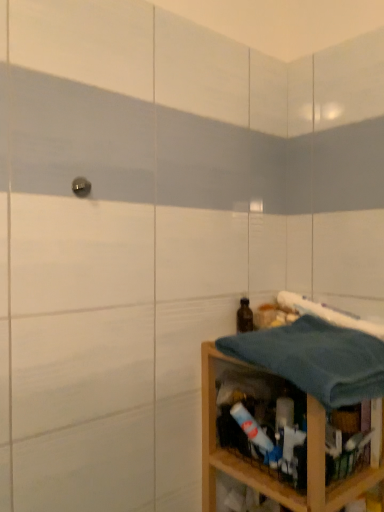
At what (x,y) coordinates should I click in order to perform the action: click on brown glass bottle at lower right. Please return your answer as a coordinate pair (x, y). Looking at the image, I should click on (244, 316).

The image size is (384, 512). Describe the element at coordinates (327, 313) in the screenshot. I see `blue waffle weave bath towel at right, which is the second bath towel from bottom to top` at that location.

Locate an element on the screen. The width and height of the screenshot is (384, 512). wooden shelf at lower right is located at coordinates (265, 472).

The width and height of the screenshot is (384, 512). What are the coordinates of `blue cotton towel at lower right, acting as the 2th bath towel starting from the top` in the screenshot? It's located at (316, 359).

Is brown glass bottle at lower right to the left or to the right of wooden shelf at lower right in the image?

brown glass bottle at lower right is to the left of wooden shelf at lower right.

Does point (251, 327) come farther from viewer compared to point (296, 503)?

That is True.

In the scene shown: Is brown glass bottle at lower right further to camera compared to wooden shelf at lower right?

Yes, brown glass bottle at lower right is further from the camera.

Is wooden shelf at lower right turned away from brown glass bottle at lower right?

No.

From the picture: Is wooden shelf at lower right inside or outside of brown glass bottle at lower right?

The correct answer is: outside.

Which point is more distant from viewer, [247,366] or [242,322]?

The point [242,322] is farther.

At what (x,y) coordinates should I click in order to perform the action: click on bottle on the left of wooden shelf at lower right. Please return your answer as a coordinate pair (x, y). Image resolution: width=384 pixels, height=512 pixels. Looking at the image, I should click on (244, 316).

Considering the relative positions of wooden shelf at lower right and blue cotton towel at lower right, acting as the 2th bath towel starting from the top, in the image provided, is wooden shelf at lower right to the left or to the right of blue cotton towel at lower right, acting as the 2th bath towel starting from the top,?

wooden shelf at lower right is positioned on blue cotton towel at lower right, acting as the 2th bath towel starting from the top,'s right side.

Is wooden shelf at lower right placed right next to blue cotton towel at lower right, acting as the 2th bath towel starting from the top?

They are not placed beside each other.

Based on the photo, from a real-world perspective, is wooden shelf at lower right physically below blue cotton towel at lower right, acting as the 2th bath towel starting from the top?

Yes.

At what (x,y) coordinates should I click in order to perform the action: click on the 1st bath towel positioned above the wooden shelf at lower right (from the image's perspective). Please return your answer as a coordinate pair (x, y). This screenshot has height=512, width=384. Looking at the image, I should click on click(x=316, y=359).

From the image's perspective, which object appears higher, blue cotton towel at lower right, the first bath towel from the bottom, or blue waffle weave bath towel at right, which is the second bath towel from bottom to top?

blue waffle weave bath towel at right, which is the second bath towel from bottom to top, is shown above in the image.

Is point (336, 373) farther from viewer compared to point (328, 311)?

No, (336, 373) is closer to viewer.

Considering the sizes of objects blue cotton towel at lower right, acting as the 2th bath towel starting from the top, and blue waffle weave bath towel at right, arranged as the 1th bath towel when viewed from the top, in the image provided, who is shorter, blue cotton towel at lower right, acting as the 2th bath towel starting from the top, or blue waffle weave bath towel at right, arranged as the 1th bath towel when viewed from the top,?

With less height is blue waffle weave bath towel at right, arranged as the 1th bath towel when viewed from the top.

From a real-world perspective, is blue cotton towel at lower right, acting as the 2th bath towel starting from the top, positioned over blue waffle weave bath towel at right, which is the second bath towel from bottom to top, based on gravity?

Incorrect, from a real-world perspective, blue cotton towel at lower right, acting as the 2th bath towel starting from the top, is lower than blue waffle weave bath towel at right, which is the second bath towel from bottom to top.

Measure the distance from brown glass bottle at lower right to blue waffle weave bath towel at right, which is the second bath towel from bottom to top.

brown glass bottle at lower right and blue waffle weave bath towel at right, which is the second bath towel from bottom to top, are 7.91 inches apart.

Does brown glass bottle at lower right appear on the right side of blue waffle weave bath towel at right, arranged as the 1th bath towel when viewed from the top?

No, brown glass bottle at lower right is not to the right of blue waffle weave bath towel at right, arranged as the 1th bath towel when viewed from the top.

From a real-world perspective, is brown glass bottle at lower right positioned above or below blue waffle weave bath towel at right, which is the second bath towel from bottom to top?

In terms of real-world spatial position, brown glass bottle at lower right is below blue waffle weave bath towel at right, which is the second bath towel from bottom to top.

Between point (251, 323) and point (369, 331), which one is positioned in front?

The point (369, 331) is closer to the camera.

Considering the points (311, 367) and (211, 504), which point is in front, point (311, 367) or point (211, 504)?

The point (311, 367) is more forward.

Between blue cotton towel at lower right, acting as the 2th bath towel starting from the top, and wooden shelf at lower right, which one has more height?

Standing taller between the two is wooden shelf at lower right.

How distant is blue cotton towel at lower right, the first bath towel from the bottom, from wooden shelf at lower right?

6.39 inches.

Locate an element on the screen. This screenshot has height=512, width=384. shelf below the blue cotton towel at lower right, acting as the 2th bath towel starting from the top (from a real-world perspective) is located at coordinates (265, 472).

Looking at this image, would you say wooden shelf at lower right is inside or outside blue waffle weave bath towel at right, which is the second bath towel from bottom to top?

wooden shelf at lower right lies outside blue waffle weave bath towel at right, which is the second bath towel from bottom to top.

Are wooden shelf at lower right and blue waffle weave bath towel at right, arranged as the 1th bath towel when viewed from the top, located far from each other?

No, wooden shelf at lower right is not far away from blue waffle weave bath towel at right, arranged as the 1th bath towel when viewed from the top.

Is wooden shelf at lower right positioned with its back to blue waffle weave bath towel at right, arranged as the 1th bath towel when viewed from the top?

No, wooden shelf at lower right is not facing away from blue waffle weave bath towel at right, arranged as the 1th bath towel when viewed from the top.

Who is shorter, wooden shelf at lower right or blue waffle weave bath towel at right, arranged as the 1th bath towel when viewed from the top?

With less height is blue waffle weave bath towel at right, arranged as the 1th bath towel when viewed from the top.

Find the location of a particular element. bottle above the wooden shelf at lower right (from a real-world perspective) is located at coordinates (244, 316).

The height and width of the screenshot is (512, 384). Find the location of `shelf that is in front of the brown glass bottle at lower right`. shelf that is in front of the brown glass bottle at lower right is located at coordinates (265, 472).

Estimate the real-world distances between objects in this image. Which object is closer to wooden shelf at lower right, blue cotton towel at lower right, acting as the 2th bath towel starting from the top, or brown glass bottle at lower right?

blue cotton towel at lower right, acting as the 2th bath towel starting from the top, is positioned closer to the anchor wooden shelf at lower right.

Which object lies further to the anchor point wooden shelf at lower right, blue waffle weave bath towel at right, which is the second bath towel from bottom to top, or blue cotton towel at lower right, the first bath towel from the bottom?

blue waffle weave bath towel at right, which is the second bath towel from bottom to top, is further to wooden shelf at lower right.

Considering their positions, is blue cotton towel at lower right, the first bath towel from the bottom, positioned closer to blue waffle weave bath towel at right, which is the second bath towel from bottom to top, than brown glass bottle at lower right?

Based on the image, brown glass bottle at lower right appears to be nearer to blue waffle weave bath towel at right, which is the second bath towel from bottom to top.

Looking at the image, which one is located further to blue waffle weave bath towel at right, which is the second bath towel from bottom to top, brown glass bottle at lower right or wooden shelf at lower right?

wooden shelf at lower right is positioned further to the anchor blue waffle weave bath towel at right, which is the second bath towel from bottom to top.

Estimate the real-world distances between objects in this image. Which object is further from blue cotton towel at lower right, the first bath towel from the bottom, blue waffle weave bath towel at right, which is the second bath towel from bottom to top, or brown glass bottle at lower right?

brown glass bottle at lower right is positioned further to the anchor blue cotton towel at lower right, the first bath towel from the bottom.

Considering their positions, is wooden shelf at lower right positioned further to blue waffle weave bath towel at right, arranged as the 1th bath towel when viewed from the top, than blue cotton towel at lower right, the first bath towel from the bottom?

wooden shelf at lower right lies further to blue waffle weave bath towel at right, arranged as the 1th bath towel when viewed from the top, than the other object.

Looking at the image, which one is located further to brown glass bottle at lower right, blue cotton towel at lower right, the first bath towel from the bottom, or wooden shelf at lower right?

wooden shelf at lower right.

From the picture: Looking at the image, which one is located closer to blue cotton towel at lower right, acting as the 2th bath towel starting from the top, blue waffle weave bath towel at right, arranged as the 1th bath towel when viewed from the top, or wooden shelf at lower right?

Among the two, wooden shelf at lower right is located nearer to blue cotton towel at lower right, acting as the 2th bath towel starting from the top.

Identify the location of bath towel located between blue cotton towel at lower right, the first bath towel from the bottom, and brown glass bottle at lower right in the depth direction. The height and width of the screenshot is (512, 384). (327, 313).

At what (x,y) coordinates should I click in order to perform the action: click on shelf between blue cotton towel at lower right, acting as the 2th bath towel starting from the top, and brown glass bottle at lower right from front to back. Please return your answer as a coordinate pair (x, y). The image size is (384, 512). Looking at the image, I should click on (265, 472).

You are a GUI agent. You are given a task and a screenshot of the screen. Output one action in this format:
    pyautogui.click(x=<x>, y=<y>)
    Task: Click on the bath towel between blue waffle weave bath towel at right, arranged as the 1th bath towel when viewed from the top, and wooden shelf at lower right vertically
    The image size is (384, 512).
    Given the screenshot: What is the action you would take?
    pyautogui.click(x=316, y=359)

You are a GUI agent. You are given a task and a screenshot of the screen. Output one action in this format:
    pyautogui.click(x=<x>, y=<y>)
    Task: Click on the bottle between blue waffle weave bath towel at right, arranged as the 1th bath towel when viewed from the top, and wooden shelf at lower right from top to bottom
    The width and height of the screenshot is (384, 512).
    Given the screenshot: What is the action you would take?
    pyautogui.click(x=244, y=316)